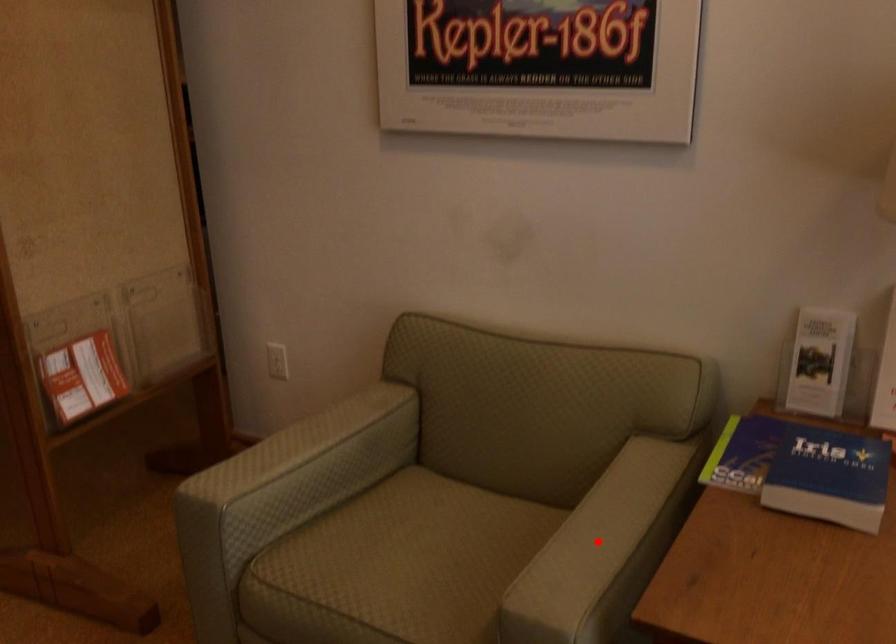
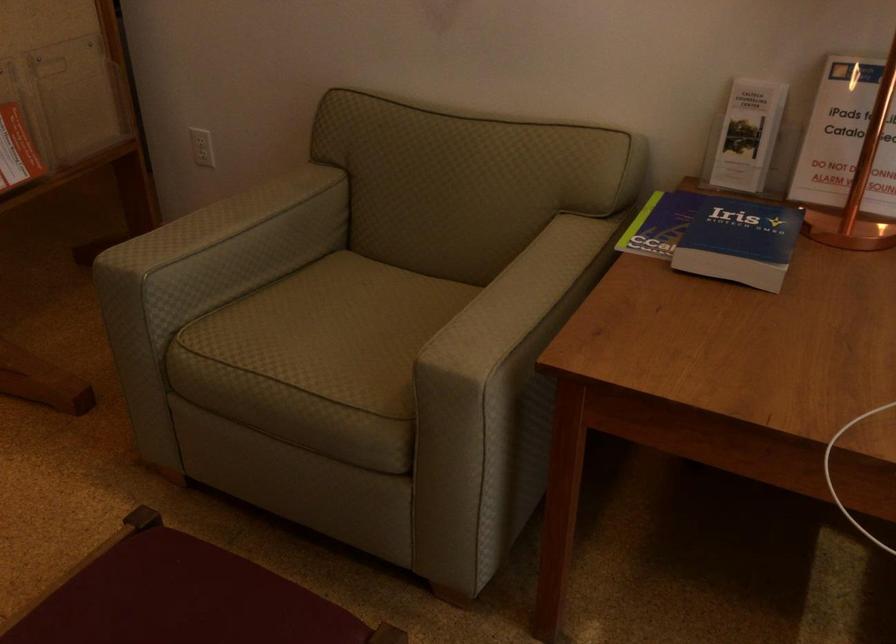
The point at the highlighted location is marked in the first image. Where is the corresponding point in the second image?

(515, 299)